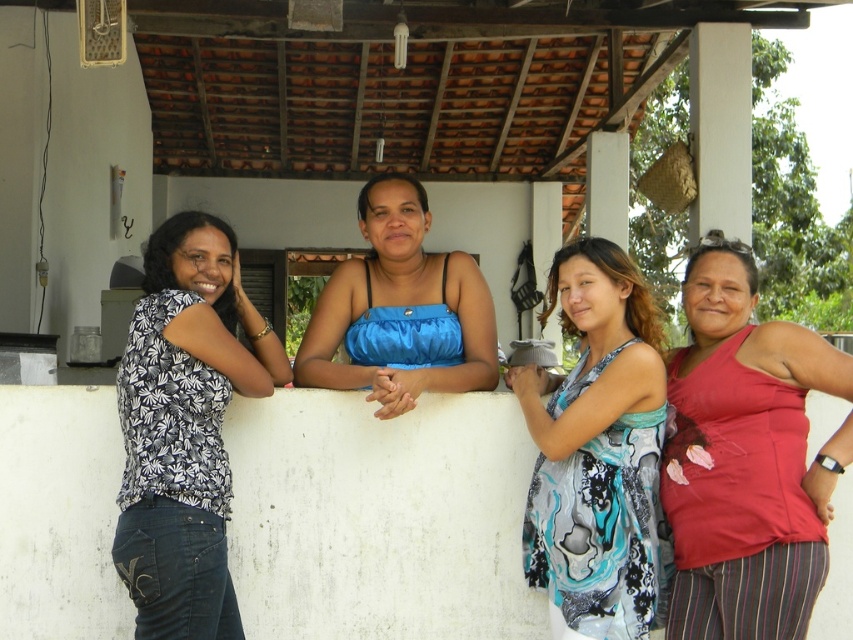
Who is lower down, printed silk dress at center or blue satin top at center?

printed silk dress at center

Between printed silk dress at center and blue satin top at center, which one appears on the right side from the viewer's perspective?

printed silk dress at center

Which is behind, point (606, 472) or point (386, 180)?

The point (386, 180) is more distant.

Where is `printed silk dress at center`? printed silk dress at center is located at coordinates (596, 451).

Does matte red tank top at right appear on the right side of blue satin top at center?

Yes, matte red tank top at right is to the right of blue satin top at center.

Looking at this image, which is above, matte red tank top at right or blue satin top at center?

blue satin top at center is higher up.

This screenshot has width=853, height=640. What do you see at coordinates (746, 460) in the screenshot?
I see `matte red tank top at right` at bounding box center [746, 460].

Identify the location of matte red tank top at right. The image size is (853, 640). (746, 460).

Consider the image. Measure the distance between point (735, 432) and camera.

Point (735, 432) and camera are 4.85 meters apart.

Does matte red tank top at right appear under printed silk dress at center?

Actually, matte red tank top at right is above printed silk dress at center.

Does point (721, 316) lie behind point (543, 317)?

That is False.

I want to click on matte red tank top at right, so click(746, 460).